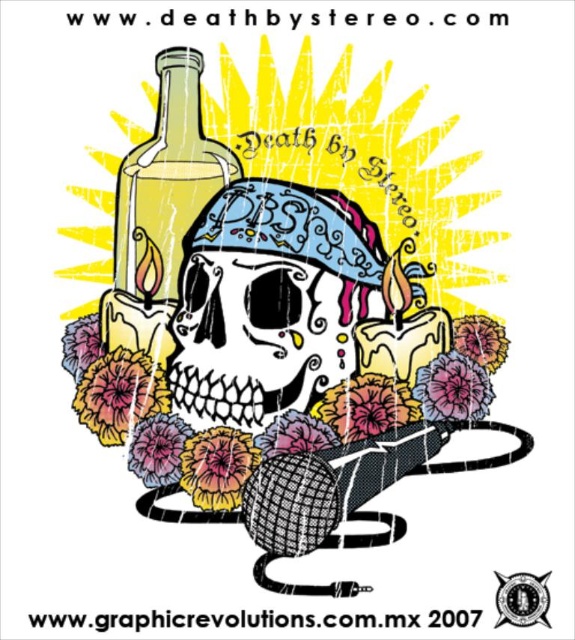
In the image, you see a black painted skull at center and a translucent glass bottle at upper left. From the perspective of someone looking at the image, which object is positioned to the right of the other?

The black painted skull at center is to the right of the translucent glass bottle at upper left according to the description.

In the image, you see a black painted skull at center and a translucent glass bottle at upper left. Which object takes up more area in the image?

The translucent glass bottle at upper left takes up more area than the black painted skull at center.